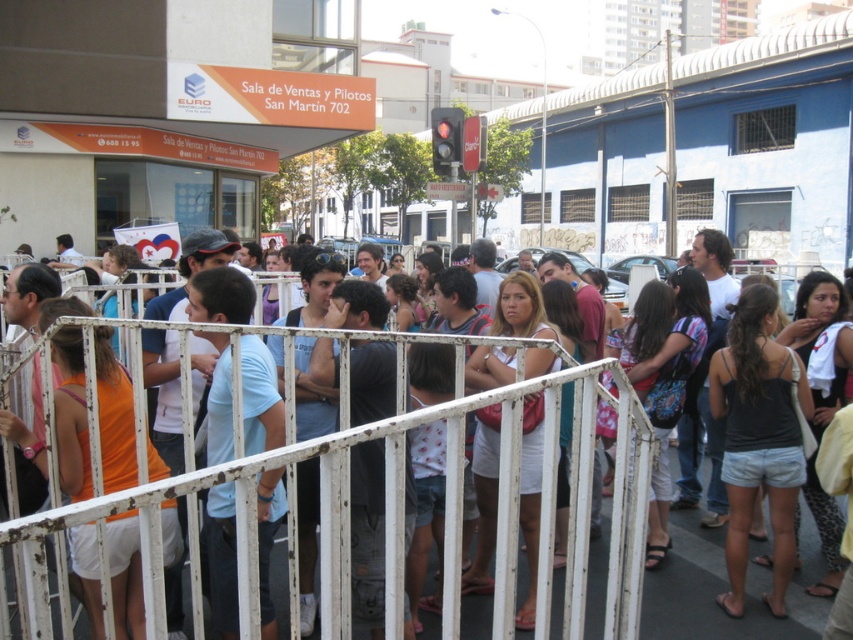
Question: Is white metal rail at center to the right of black denim shorts at center from the viewer's perspective?

Choices:
 (A) yes
 (B) no

Answer: (B)

Question: Among these points, which one is nearest to the camera?

Choices:
 (A) (779, 408)
 (B) (451, 600)
 (C) (531, 509)

Answer: (B)

Question: Which point is farther from the camera taking this photo?

Choices:
 (A) (341, 474)
 (B) (490, 444)
 (C) (790, 406)

Answer: (C)

Question: Does black denim shorts at center appear on the right side of white cotton dress at center?

Choices:
 (A) no
 (B) yes

Answer: (B)

Question: Is the position of white metal rail at center less distant than that of white cotton dress at center?

Choices:
 (A) no
 (B) yes

Answer: (B)

Question: Which of the following is the farthest from the observer?

Choices:
 (A) (502, 328)
 (B) (770, 602)

Answer: (A)